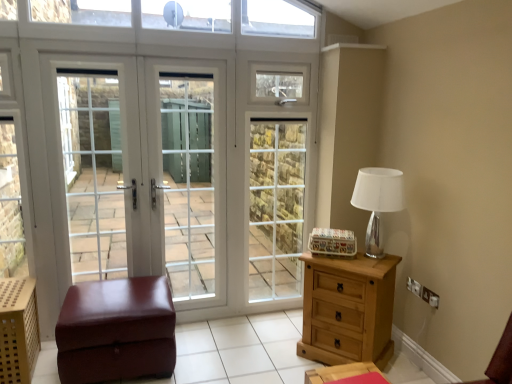
At what (x,y) coordinates should I click in order to perform the action: click on vacant area on top of white glass screen door at left, the third screen door from the right (from a real-world perspective). Please return your answer as a coordinate pair (x, y). The height and width of the screenshot is (384, 512). Looking at the image, I should click on (88, 49).